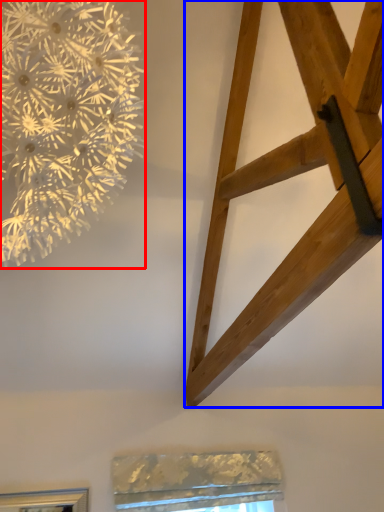
Question: Which object appears closest to the camera in this image, flower (highlighted by a red box) or furniture (highlighted by a blue box)?

Choices:
 (A) flower
 (B) furniture

Answer: (A)